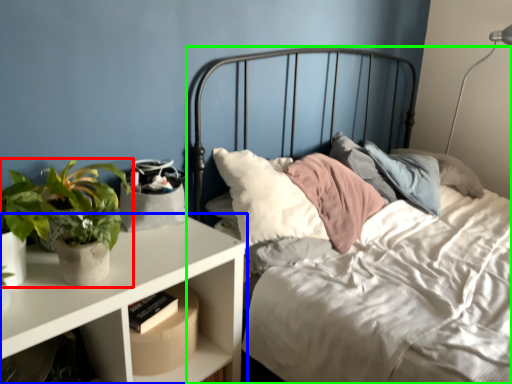
Question: Which object is the farthest from houseplant (highlighted by a red box)? Choose among these: nightstand (highlighted by a blue box) or bed (highlighted by a green box).

Choices:
 (A) nightstand
 (B) bed

Answer: (B)